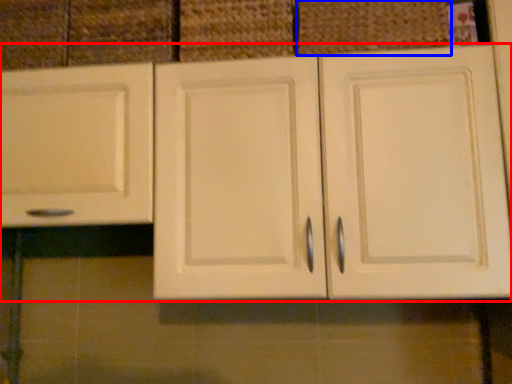
Question: Which object is closer to the camera taking this photo, cabinetry (highlighted by a red box) or basket (highlighted by a blue box)?

Choices:
 (A) cabinetry
 (B) basket

Answer: (A)